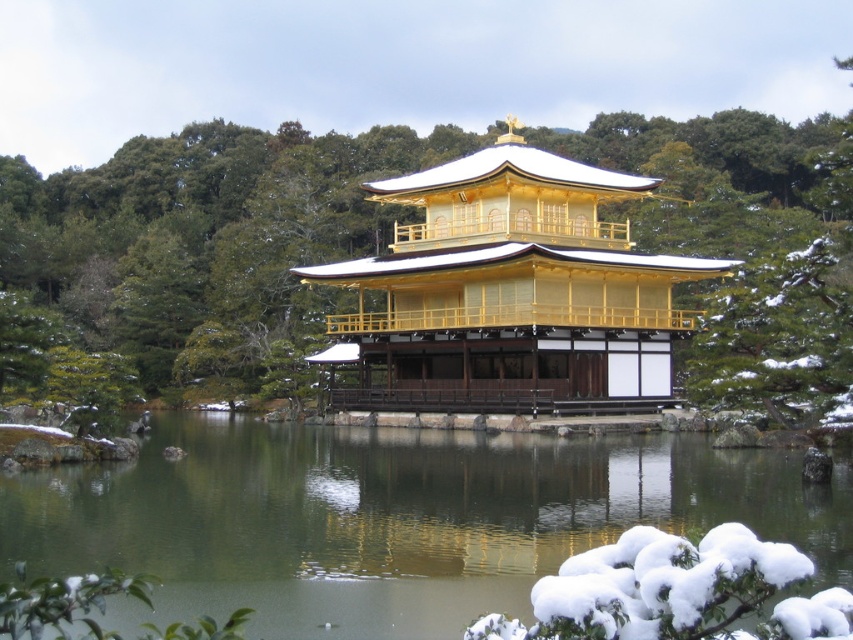
Question: Can you confirm if glossy reflective water at center is positioned above gold/polished wood palace at center?

Choices:
 (A) no
 (B) yes

Answer: (A)

Question: Can you confirm if green matte tree at center is positioned above gold/polished wood palace at center?

Choices:
 (A) no
 (B) yes

Answer: (B)

Question: Which object appears closest to the camera in this image?

Choices:
 (A) glossy reflective water at center
 (B) green matte tree at center

Answer: (A)

Question: Which point is farther from the camera taking this photo?

Choices:
 (A) (378, 312)
 (B) (97, 468)
 (C) (688, 218)

Answer: (C)

Question: Can you confirm if glossy reflective water at center is positioned to the right of gold/polished wood palace at center?

Choices:
 (A) yes
 (B) no

Answer: (B)

Question: Which of the following is the farthest from the observer?

Choices:
 (A) (177, 616)
 (B) (534, 346)

Answer: (B)